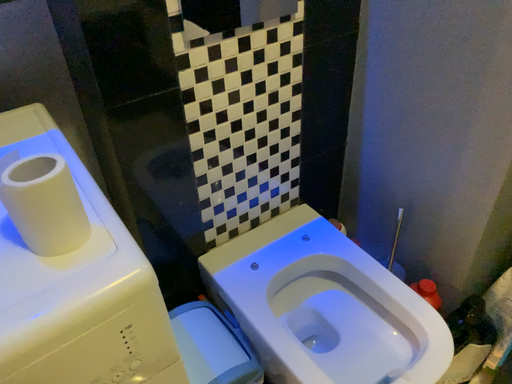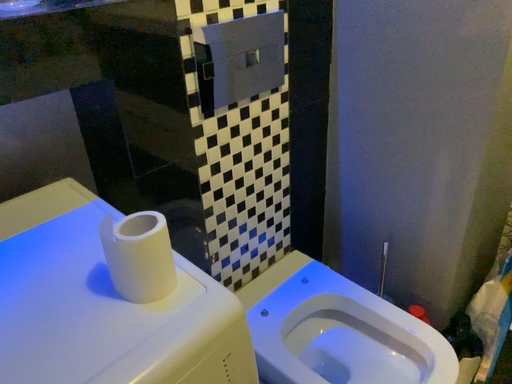
Question: How did the camera likely rotate when shooting the video?

Choices:
 (A) rotated downward
 (B) rotated upward

Answer: (B)